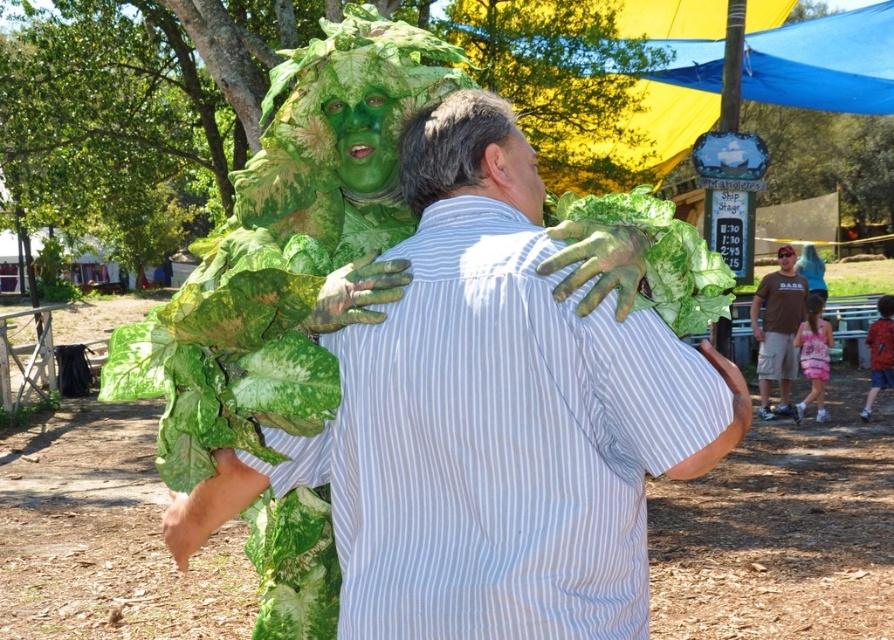
Question: Which point is farther from the camera taking this photo?

Choices:
 (A) (782, 352)
 (B) (887, 364)

Answer: (A)

Question: Which point is closer to the camera taking this photo?

Choices:
 (A) (880, 301)
 (B) (559, 212)
 (C) (819, 312)
 (D) (173, 540)

Answer: (D)

Question: Does matte green costume at center appear under pink satin dress at center?

Choices:
 (A) no
 (B) yes

Answer: (A)

Question: Is pink satin dress at lower right positioned at the back of red plaid shirt at right?

Choices:
 (A) no
 (B) yes

Answer: (A)

Question: Is pink satin dress at lower right behind red plaid shirt at right?

Choices:
 (A) yes
 (B) no

Answer: (B)

Question: Which point is farther from the camera taking this photo?

Choices:
 (A) (869, 360)
 (B) (415, 557)
 (C) (785, 310)

Answer: (A)